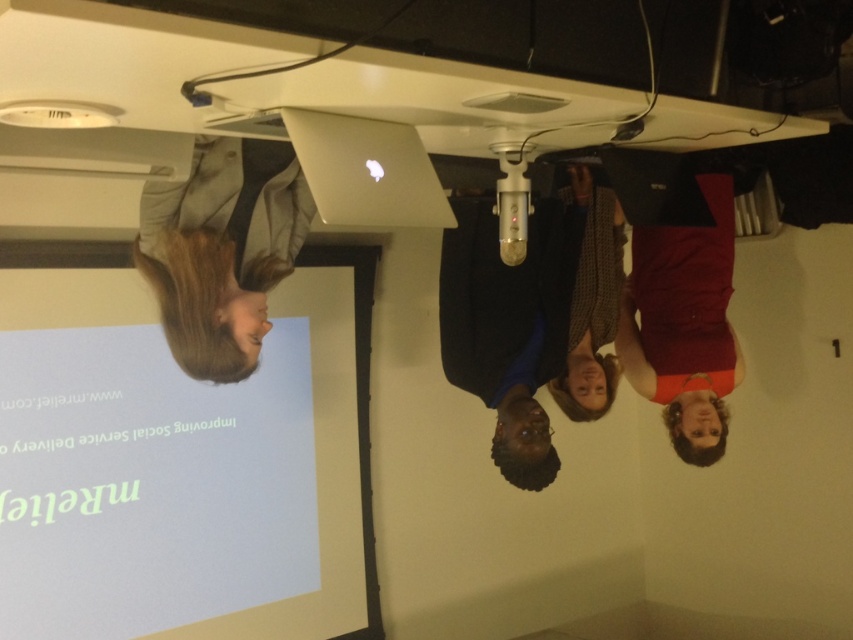
Between white matte projection screen at lower left and matte red dress at right, which one appears on the right side from the viewer's perspective?

From the viewer's perspective, matte red dress at right appears more on the right side.

Consider the image. Is white matte projection screen at lower left above matte red dress at right?

Incorrect, white matte projection screen at lower left is not positioned above matte red dress at right.

Does point (282, 401) come farther from viewer compared to point (700, 301)?

Yes, point (282, 401) is farther from viewer.

Locate an element on the screen. This screenshot has width=853, height=640. white matte projection screen at lower left is located at coordinates (231, 445).

Between dark blue shirt at center and silver metallic laptop at upper center, which one is positioned lower?

dark blue shirt at center is below.

Who is higher up, dark blue shirt at center or silver metallic laptop at upper center?

silver metallic laptop at upper center is above.

This screenshot has width=853, height=640. Identify the location of dark blue shirt at center. (532, 317).

Who is shorter, dark blue shirt at center or matte red dress at right?

dark blue shirt at center

Does dark blue shirt at center appear over matte red dress at right?

No.

Does point (546, 275) come farther from viewer compared to point (660, 246)?

No, it is in front of (660, 246).

Find the location of a particular element. Image resolution: width=853 pixels, height=640 pixels. dark blue shirt at center is located at coordinates pos(532,317).